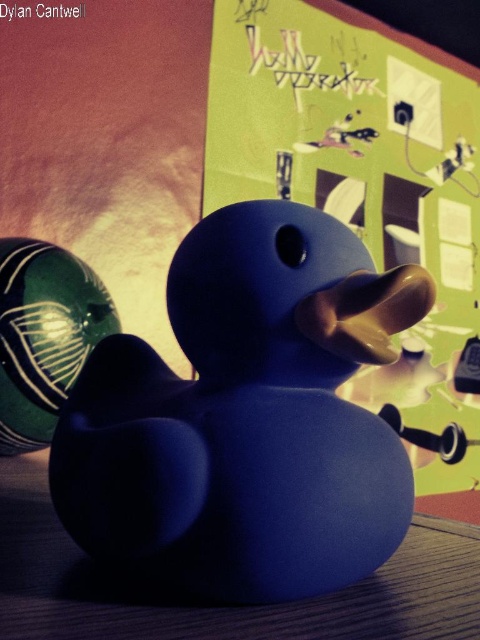
You are organizing a small event and need to hang a banner on the taller object between the matte green bulletin board at center and the wooden table at center. Which object should you choose?

The matte green bulletin board at center is taller than the wooden table at center, so you should hang the banner on the matte green bulletin board at center.

From the picture: You are trying to hang a new poster on the matte green bulletin board at center. However, you notice the green glossy ball at left is in the way. Can you hang the poster without moving the ball?

The matte green bulletin board at center is much taller than the green glossy ball at left, so you can hang the poster above or below the ball without moving it.

You are a toy collector who wants to place a new toy between the matte blue rubber duck at center and the wooden table at center. The toy is 7 inches long. Will there be enough space between them to fit the toy?

The distance between the matte blue rubber duck at center and the wooden table at center is 6.74 inches, which is slightly less than the 7 inches required for the toy. Therefore, there isn not enough space to fit the toy between them.